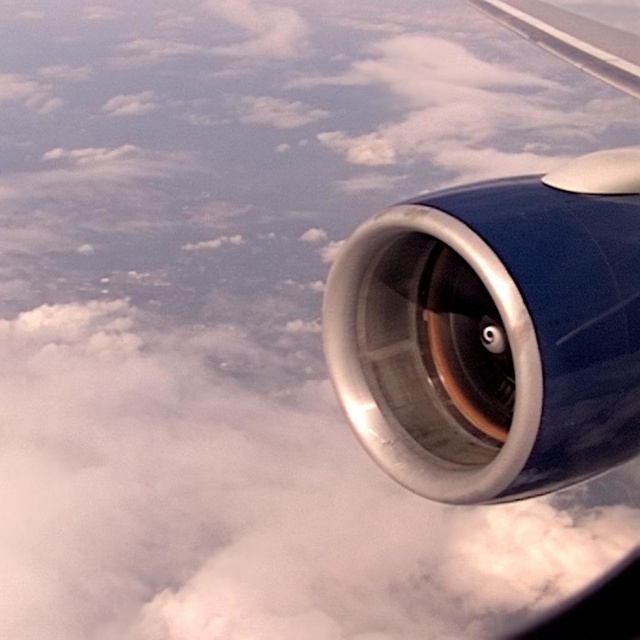
Question: Observing the image, what is the correct spatial positioning of blue metallic engine at right in reference to metallic silver wing at upper right?

Choices:
 (A) right
 (B) left

Answer: (B)

Question: Can you confirm if blue metallic engine at right is positioned to the left of metallic silver wing at upper right?

Choices:
 (A) no
 (B) yes

Answer: (B)

Question: Is blue metallic engine at right in front of metallic silver wing at upper right?

Choices:
 (A) yes
 (B) no

Answer: (A)

Question: Which point is farther to the camera?

Choices:
 (A) blue metallic engine at right
 (B) metallic silver wing at upper right

Answer: (B)

Question: Which object is closer to the camera taking this photo?

Choices:
 (A) blue metallic engine at right
 (B) metallic silver wing at upper right

Answer: (A)